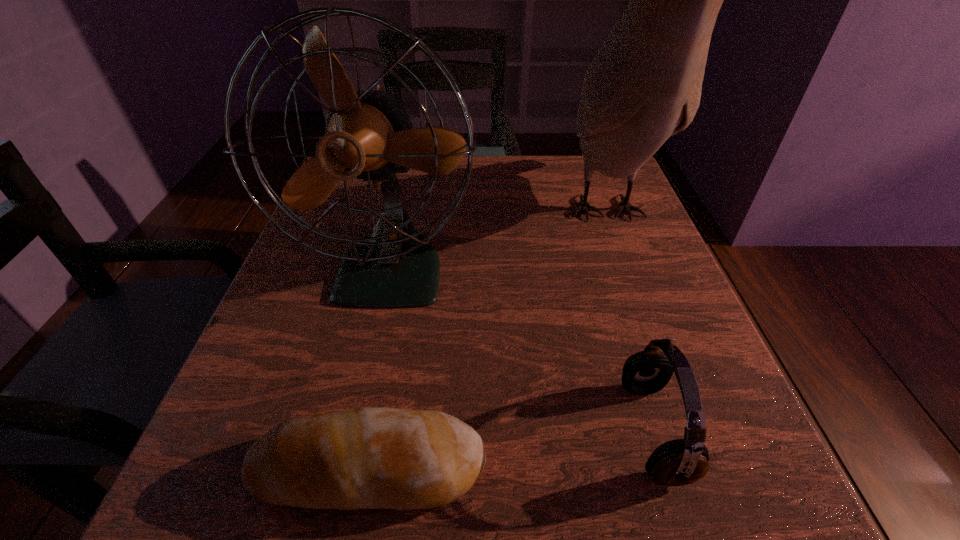
What are the coordinates of `free space between the third tallest object and the bread` in the screenshot? It's located at tap(511, 450).

The width and height of the screenshot is (960, 540). Identify the location of vacant area between the fan and the parakeet. (498, 242).

Locate an element on the screen. This screenshot has width=960, height=540. free space between the fan and the parakeet is located at coordinates (498, 242).

At what (x,y) coordinates should I click in order to perform the action: click on vacant area that lies between the parakeet and the bread. Please return your answer as a coordinate pair (x, y). The width and height of the screenshot is (960, 540). Looking at the image, I should click on (487, 341).

What are the coordinates of `object identified as the second closest to the second shortest object` in the screenshot? It's located at (361, 458).

Choose which object is the nearest neighbor to the second tallest object. Please provide its 2D coordinates. Your answer should be formatted as a tuple, i.e. [(x, y)], where the tuple contains the x and y coordinates of a point satisfying the conditions above.

[(361, 458)]

This screenshot has height=540, width=960. In order to click on vacant space that satisfies the following two spatial constraints: 1. on the front-facing side of the bread for air flow; 2. on the left side of the fan in this screenshot , I will do `click(348, 469)`.

Identify the location of blank area in the image that satisfies the following two spatial constraints: 1. on the face of the tallest object; 2. on the ear cups of the second shortest object. Image resolution: width=960 pixels, height=540 pixels. [x=684, y=431].

Locate an element on the screen. This screenshot has height=540, width=960. vacant point that satisfies the following two spatial constraints: 1. on the front-facing side of the fan for air flow; 2. on the left side of the shortest object is located at coordinates (348, 469).

At what (x,y) coordinates should I click in order to perform the action: click on vacant region that satisfies the following two spatial constraints: 1. on the face of the tallest object; 2. on the ear cups of the headset. Please return your answer as a coordinate pair (x, y). The width and height of the screenshot is (960, 540). Looking at the image, I should click on (684, 431).